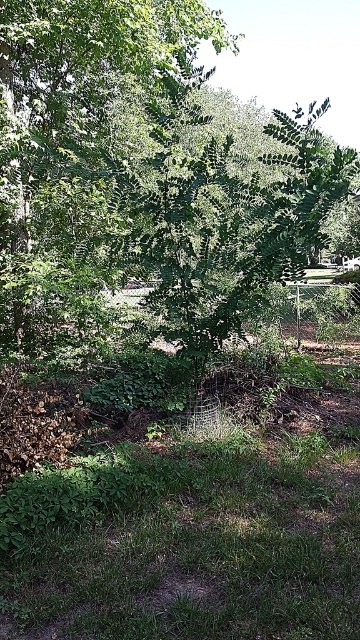
Looking at this image, is green leafy tree at center below green grass at lower center?

Incorrect, green leafy tree at center is not positioned below green grass at lower center.

Which is in front, point (144, 40) or point (64, 577)?

Point (64, 577) is in front.

Locate an element on the screen. This screenshot has width=360, height=640. green leafy tree at center is located at coordinates (119, 172).